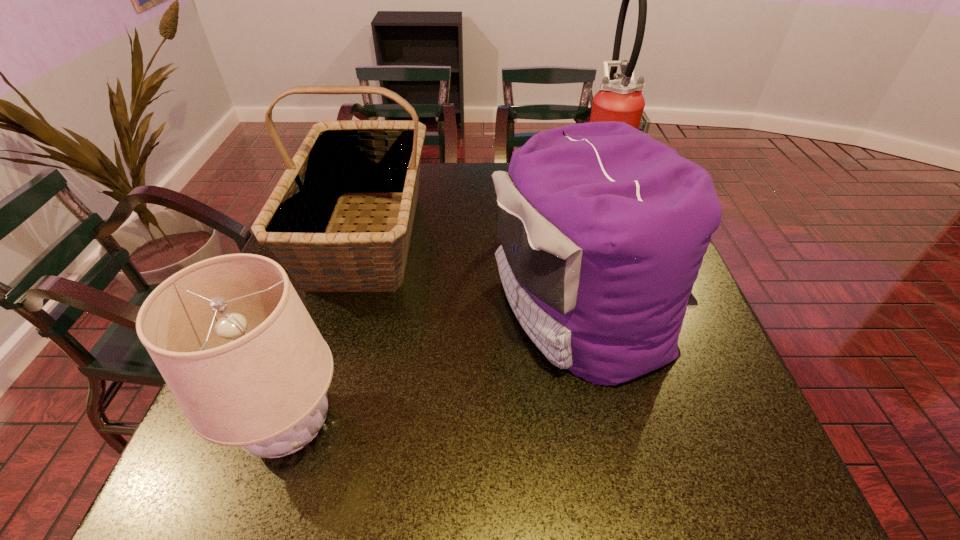
Where is `free space located on the front pocket of the backpack`? The width and height of the screenshot is (960, 540). free space located on the front pocket of the backpack is located at coordinates (328, 308).

Where is `vacant region located on the back of the lampshade`? vacant region located on the back of the lampshade is located at coordinates (337, 281).

Image resolution: width=960 pixels, height=540 pixels. I want to click on fire extinguisher that is at the far edge, so click(x=621, y=100).

This screenshot has height=540, width=960. I want to click on basket positioned at the far edge, so click(338, 159).

Where is `object that is at the near edge`? object that is at the near edge is located at coordinates (236, 346).

In order to click on basket located in the left edge section of the desktop in this screenshot , I will do `click(338, 159)`.

I want to click on lampshade situated at the left edge, so click(236, 346).

This screenshot has width=960, height=540. Identify the location of fire extinguisher that is at the right edge. (621, 100).

Find the location of a particular element. The height and width of the screenshot is (540, 960). backpack positioned at the right edge is located at coordinates (603, 229).

Where is `object that is at the far left corner`? Image resolution: width=960 pixels, height=540 pixels. object that is at the far left corner is located at coordinates (338, 159).